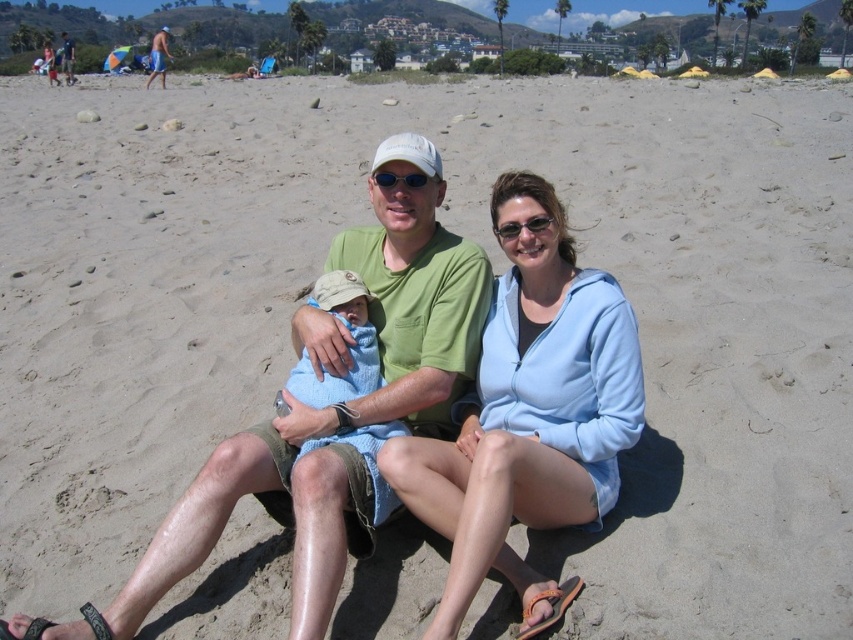
You are a photographer trying to capture the scene. You notice the blue shorts at upper left and the matte white sunglasses at center. Which object should you zoom in on to get a clearer image of the details without moving the camera?

The blue shorts at upper left is bigger than the matte white sunglasses at center, so zooming in on the blue shorts at upper left would allow you to capture more detail without moving the camera because it is larger and occupies more space in the frame.

You are a photographer at the beach and want to position a light blue fleece jacket at center in a way that it aligns with the palm trees in the background. Based on the coordinates provided, can you determine if the jacket is placed correctly?

The light blue fleece jacket at center is located at point (529, 413), which aligns with the palm trees in the background according to the coordinates provided.

In the beach scene, there are two adults and a child. The adult on the left is wearing a green tshirt and khaki shorts, and the adult on the right is wearing a light blue hoodie and dark shorts. There is also a light blue fleece jacket at center. If you were standing at the point marked by coordinates [529,413], which corresponds to the location of the light blue fleece jacket at center, which direction would you face to look directly at the adult on the left?

The light blue fleece jacket at center is located at point [529,413]. To face the adult on the left wearing the green tshirt and khaki shorts, you would need to turn towards the left side of the scene since the jacket is centrally positioned and the adult on the left is positioned to the left of the jacket.